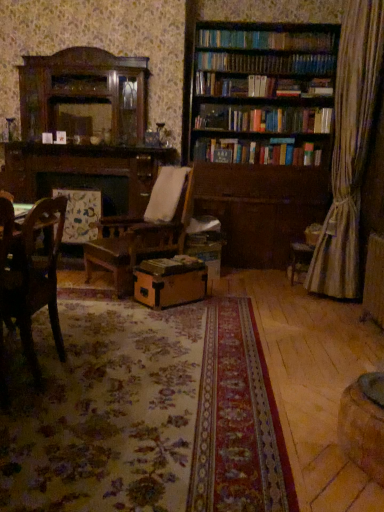
Question: From a real-world perspective, is wooden chair at left under brown cardboard box at center?

Choices:
 (A) no
 (B) yes

Answer: (A)

Question: Is wooden chair at left positioned with its back to brown cardboard box at center?

Choices:
 (A) yes
 (B) no

Answer: (B)

Question: Considering the relative sizes of wooden chair at left and brown cardboard box at center in the image provided, is wooden chair at left shorter than brown cardboard box at center?

Choices:
 (A) yes
 (B) no

Answer: (B)

Question: From the image's perspective, does wooden chair at left appear lower than brown cardboard box at center?

Choices:
 (A) yes
 (B) no

Answer: (B)

Question: Would you say wooden chair at left contains brown cardboard box at center?

Choices:
 (A) yes
 (B) no

Answer: (B)

Question: From the image's perspective, is wooden chair at left on brown cardboard box at center?

Choices:
 (A) no
 (B) yes

Answer: (B)

Question: Can you confirm if brown cardboard box at center is shorter than brown wooden bookcase at upper right?

Choices:
 (A) yes
 (B) no

Answer: (A)

Question: Considering the relative positions of brown cardboard box at center and brown wooden bookcase at upper right in the image provided, is brown cardboard box at center to the left of brown wooden bookcase at upper right from the viewer's perspective?

Choices:
 (A) yes
 (B) no

Answer: (A)

Question: Is brown cardboard box at center positioned before brown wooden bookcase at upper right?

Choices:
 (A) yes
 (B) no

Answer: (A)

Question: From a real-world perspective, does brown cardboard box at center stand above brown wooden bookcase at upper right?

Choices:
 (A) no
 (B) yes

Answer: (A)

Question: Is brown cardboard box at center positioned with its back to brown wooden bookcase at upper right?

Choices:
 (A) no
 (B) yes

Answer: (B)

Question: Is brown cardboard box at center far from brown wooden bookcase at upper right?

Choices:
 (A) no
 (B) yes

Answer: (B)

Question: Is brown wooden bookcase at upper right facing away from wooden chair at left?

Choices:
 (A) yes
 (B) no

Answer: (B)